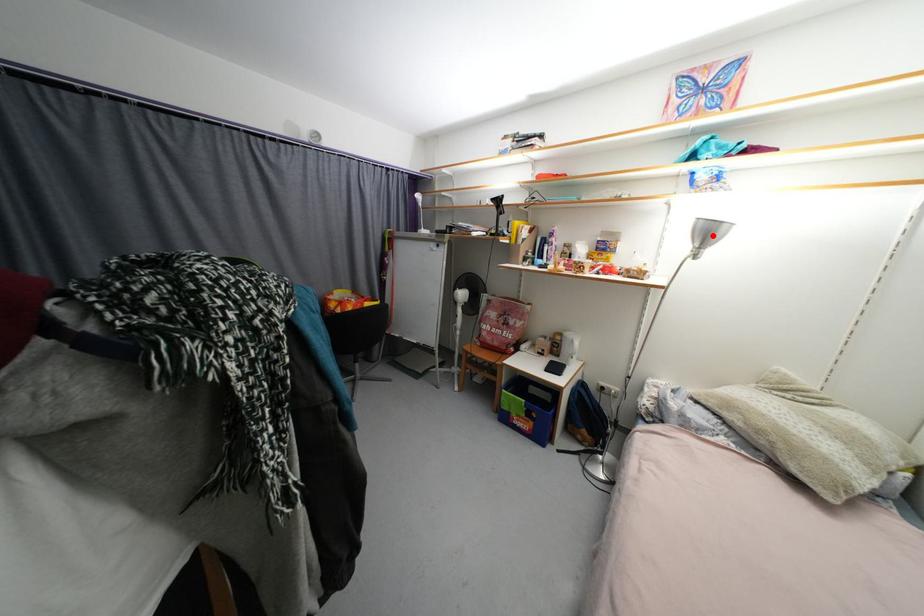
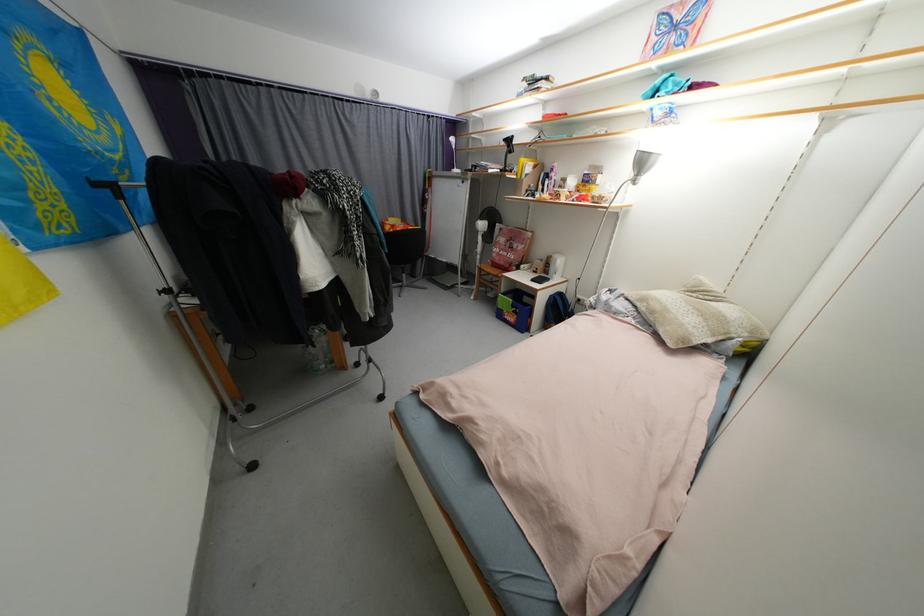
Locate, in the second image, the point that corresponds to the highlighted location in the first image.

(648, 164)